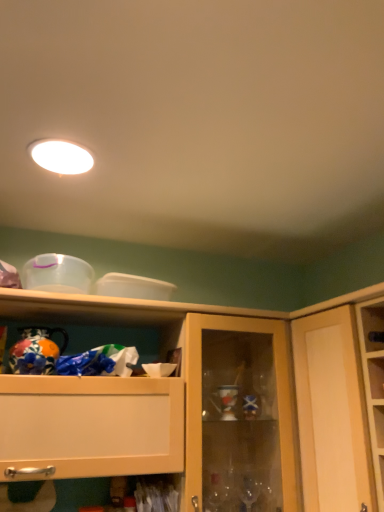
Question: Would you say white glossy light fixture at upper center is inside or outside hand-painted ceramic vase at left?

Choices:
 (A) inside
 (B) outside

Answer: (B)

Question: Based on their sizes in the image, would you say white glossy light fixture at upper center is bigger or smaller than hand-painted ceramic vase at left?

Choices:
 (A) big
 (B) small

Answer: (B)

Question: Estimate the real-world distances between objects in this image. Which object is farther from the wooden cabinet at upper center?

Choices:
 (A) white glossy light fixture at upper center
 (B) matte wood cupboard at right
 (C) hand-painted ceramic vase at left

Answer: (A)

Question: Based on their relative distances, which object is farther from the white glossy light fixture at upper center?

Choices:
 (A) matte wood cupboard at right
 (B) wooden cabinet at upper center
 (C) hand-painted ceramic vase at left

Answer: (A)